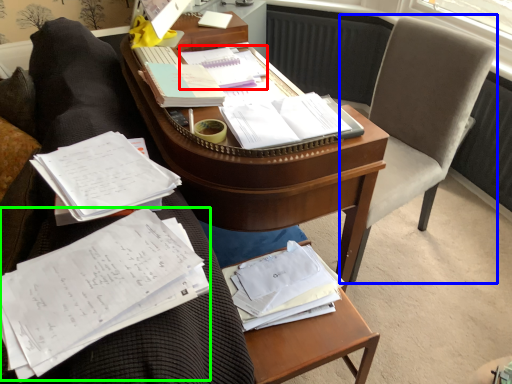
Question: Considering the real-world distances, which object is farthest from book (highlighted by a red box)? swivel chair (highlighted by a blue box) or document (highlighted by a green box)?

Choices:
 (A) swivel chair
 (B) document

Answer: (B)